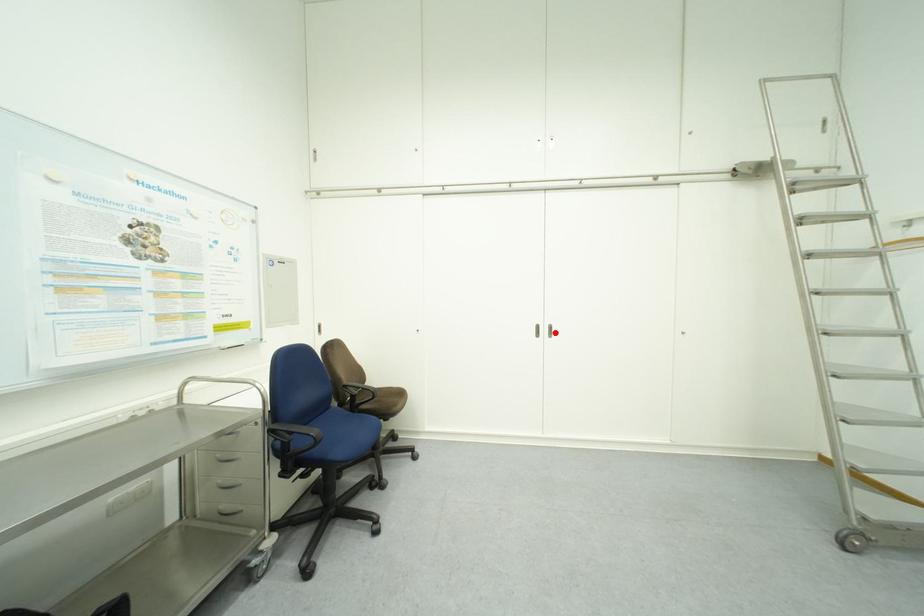
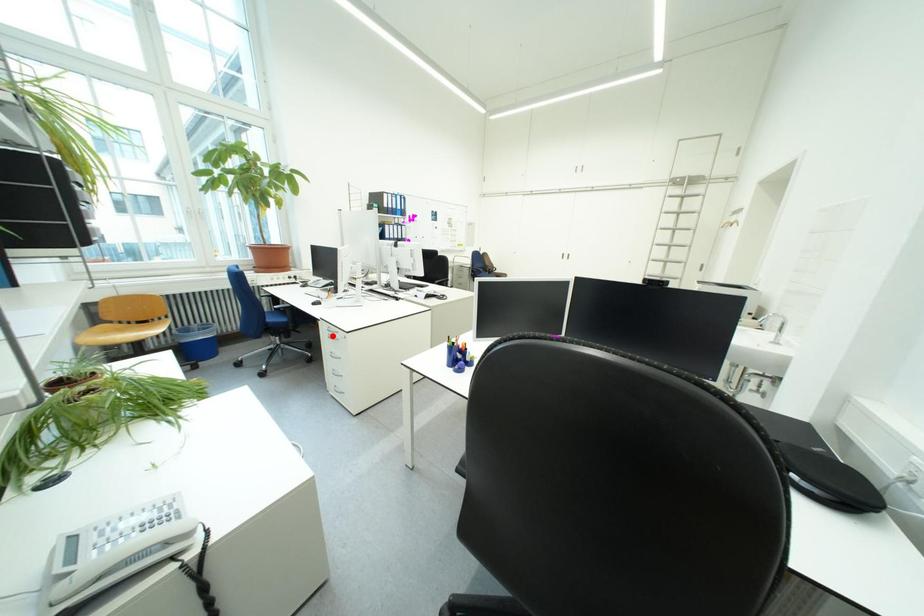
I am providing you with two images of the same scene from different viewpoints. A red point is marked on the first image and another point is marked on the second image. Is the red point in image1 aligned with the point shown in image2?

No